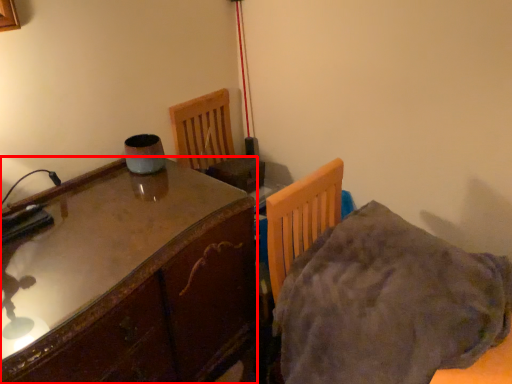
Question: Where is table (annotated by the red box) located in relation to blanket in the image?

Choices:
 (A) left
 (B) right

Answer: (A)